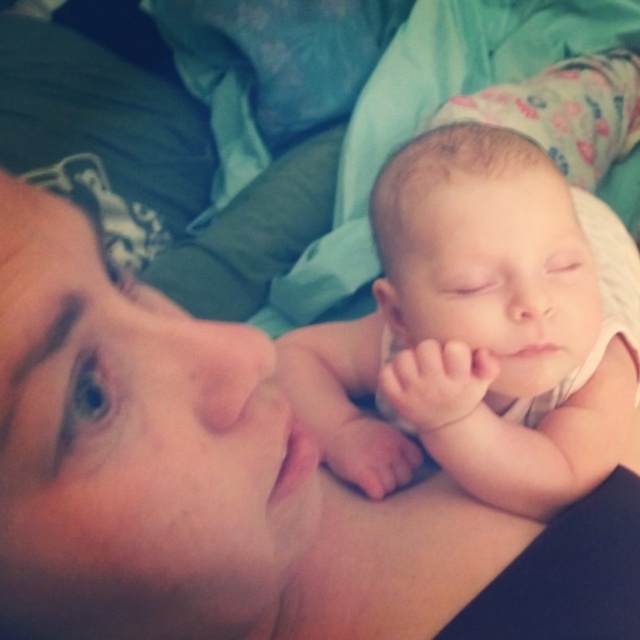
Question: Which object appears farthest from the camera in this image?

Choices:
 (A) smooth skin newborn at center
 (B) smooth skin baby at center

Answer: (A)

Question: Observing the image, what is the correct spatial positioning of smooth skin baby at center in reference to smooth skin newborn at center?

Choices:
 (A) right
 (B) left

Answer: (B)

Question: Is smooth skin baby at center above smooth skin newborn at center?

Choices:
 (A) yes
 (B) no

Answer: (B)

Question: Can you confirm if smooth skin baby at center is smaller than smooth skin newborn at center?

Choices:
 (A) yes
 (B) no

Answer: (B)